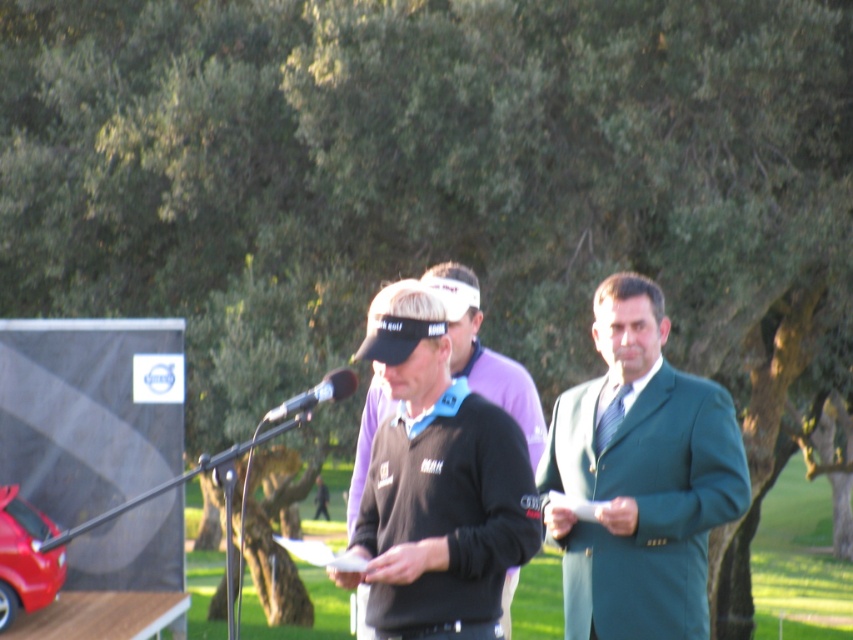
Is black matte jacket at center shorter than black metallic microphone at center?

No, black matte jacket at center is not shorter than black metallic microphone at center.

Does black matte jacket at center have a greater height compared to black metallic microphone at center?

Yes, black matte jacket at center is taller than black metallic microphone at center.

Between point (473, 483) and point (277, 419), which one is positioned behind?

Point (277, 419)

This screenshot has width=853, height=640. What are the coordinates of `black matte jacket at center` in the screenshot? It's located at (437, 481).

Who is lower down, green wool suit at center or black matte jacket at center?

green wool suit at center is lower down.

Which of these two, green wool suit at center or black matte jacket at center, stands shorter?

black matte jacket at center is shorter.

Between point (653, 474) and point (495, 624), which one is positioned behind?

The point (653, 474) is more distant.

Locate an element on the screen. This screenshot has height=640, width=853. green wool suit at center is located at coordinates (640, 477).

Does green wool suit at center have a greater width compared to black metallic microphone at center?

In fact, green wool suit at center might be narrower than black metallic microphone at center.

Describe the element at coordinates (640, 477) in the screenshot. I see `green wool suit at center` at that location.

Where is `green wool suit at center`? The width and height of the screenshot is (853, 640). green wool suit at center is located at coordinates (640, 477).